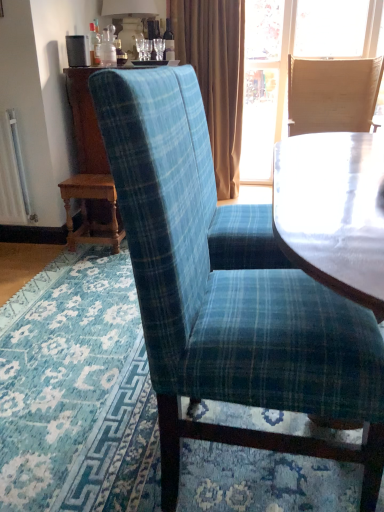
You are a GUI agent. You are given a task and a screenshot of the screen. Output one action in this format:
    pyautogui.click(x=<x>, y=<y>)
    Task: Click on the free spot below wooden table at lower left (from a real-world perspective)
    The width and height of the screenshot is (384, 512).
    Given the screenshot: What is the action you would take?
    pyautogui.click(x=95, y=245)